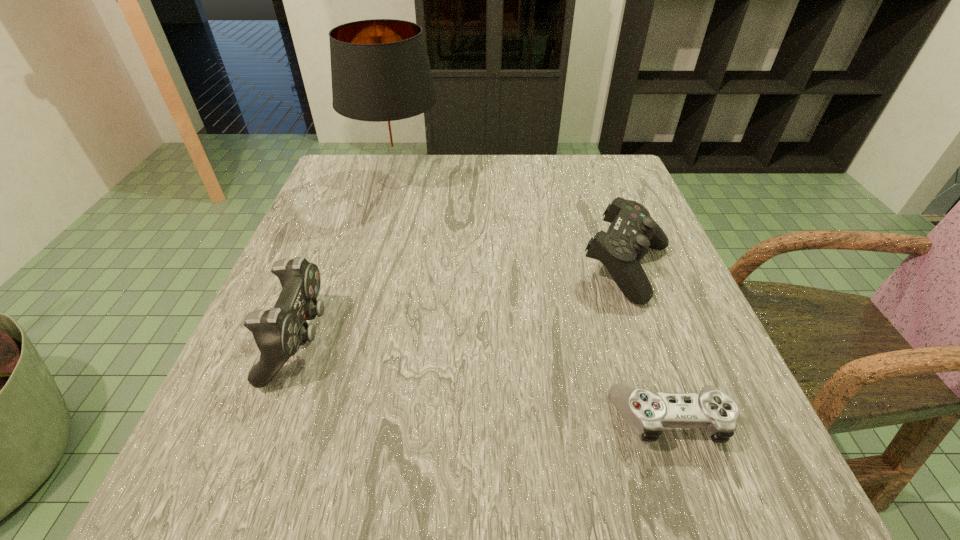
Identify the location of the tallest object. (381, 77).

This screenshot has height=540, width=960. Find the location of `lampshade`. lampshade is located at coordinates (381, 77).

At what (x,y) coordinates should I click in order to perform the action: click on the third shortest object. Please return your answer as a coordinate pair (x, y). Looking at the image, I should click on (278, 332).

Locate an element on the screen. Image resolution: width=960 pixels, height=540 pixels. the leftmost control is located at coordinates (278, 332).

Identify the location of the third tallest object. (632, 231).

Locate an element on the screen. the shortest object is located at coordinates (647, 412).

Identify the location of free location located on the front of the tallest object. (362, 313).

Locate an element on the screen. Image resolution: width=960 pixels, height=540 pixels. free spot located on the surface of the leftmost control with buttons is located at coordinates (503, 340).

Where is `free spot located 0.070m on the front of the third tallest object`? free spot located 0.070m on the front of the third tallest object is located at coordinates click(x=654, y=341).

Identify the location of free spot located 0.100m on the back of the shortest control. (641, 336).